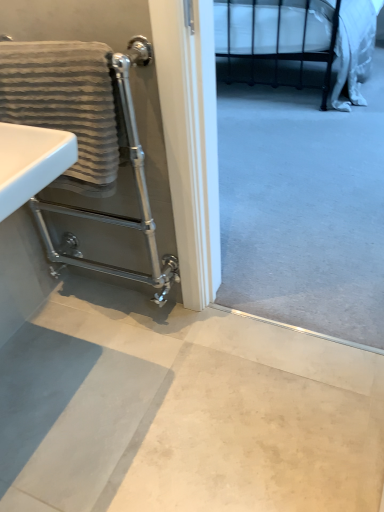
Question: From their relative heights in the image, would you say silver metallic towel rack at left is taller or shorter than gray textured towel at left?

Choices:
 (A) short
 (B) tall

Answer: (B)

Question: Is point (165, 164) positioned closer to the camera than point (100, 169)?

Choices:
 (A) farther
 (B) closer

Answer: (A)

Question: Estimate the real-world distances between objects in this image. Which object is farther from the silver metallic towel rack at left?

Choices:
 (A) smooth concrete floor at lower center
 (B) gray textured towel at left
 (C) black metal bed at upper right

Answer: (C)

Question: Based on their relative distances, which object is nearer to the gray textured towel at left?

Choices:
 (A) silver metallic towel rack at left
 (B) smooth concrete floor at lower center
 (C) black metal bed at upper right

Answer: (A)